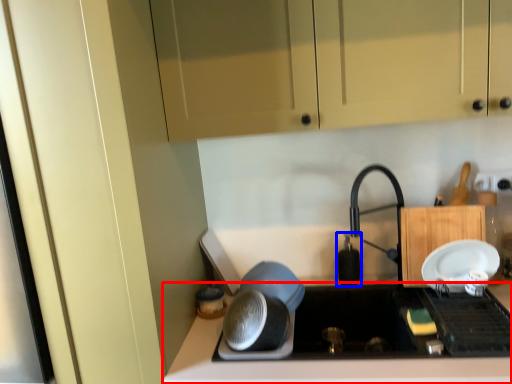
Question: Which object is closer to the camera taking this photo, countertop (highlighted by a red box) or appliance (highlighted by a blue box)?

Choices:
 (A) countertop
 (B) appliance

Answer: (A)